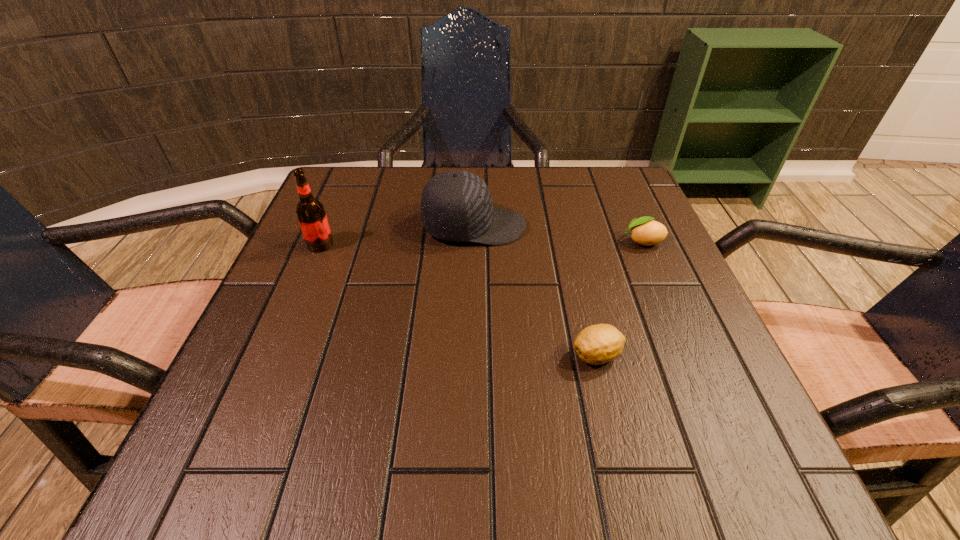
In order to click on free space between the farther lemon and the second tallest object in this screenshot , I will do `click(559, 234)`.

The height and width of the screenshot is (540, 960). Find the location of `vacant point located between the rightmost object and the second object from right to left`. vacant point located between the rightmost object and the second object from right to left is located at coordinates (619, 299).

Where is `vacant area that lies between the second object from right to left and the rightmost object`? The width and height of the screenshot is (960, 540). vacant area that lies between the second object from right to left and the rightmost object is located at coordinates (619, 299).

Image resolution: width=960 pixels, height=540 pixels. In order to click on free area in between the third object from left to right and the rightmost object in this screenshot , I will do `click(619, 299)`.

Find the location of `free spot between the third shortest object and the leftmost object`. free spot between the third shortest object and the leftmost object is located at coordinates (397, 235).

Locate an element on the screen. Image resolution: width=960 pixels, height=540 pixels. the third closest object to the nearer lemon is located at coordinates (310, 212).

Locate which object is the third closest to the leftmost object. Please provide its 2D coordinates. Your answer should be formatted as a tuple, i.e. [(x, y)], where the tuple contains the x and y coordinates of a point satisfying the conditions above.

[(644, 231)]

Find the location of a particular element. The height and width of the screenshot is (540, 960). vacant space that satisfies the following two spatial constraints: 1. with leaves positioned above the farther lemon; 2. on the front side of the leftmost object is located at coordinates tap(644, 245).